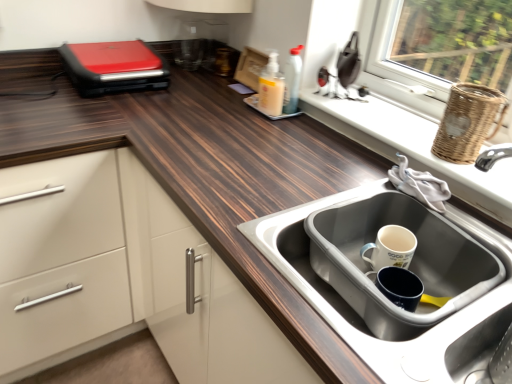
This screenshot has width=512, height=384. In order to click on free point to the left of woven brown basket at upper right in this screenshot , I will do `click(402, 138)`.